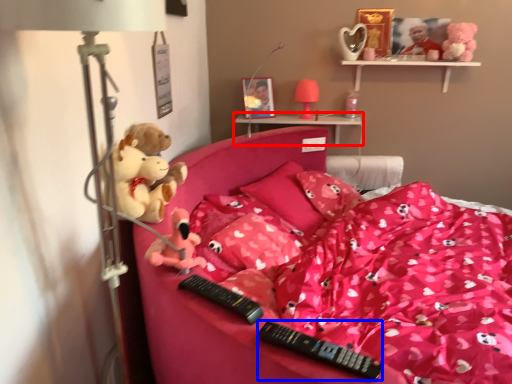
Question: Which point is further to the camera, shelf (highlighted by a red box) or remote (highlighted by a blue box)?

Choices:
 (A) shelf
 (B) remote

Answer: (A)